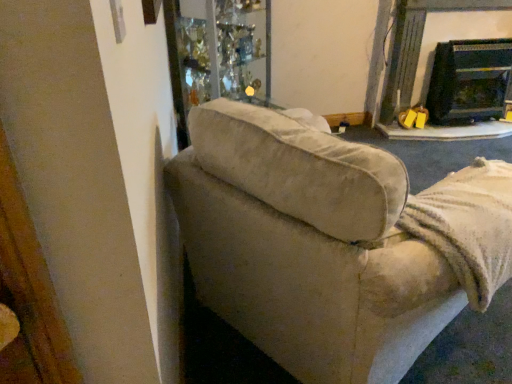
Question: Is the depth of beige fabric couch at left less than that of black glossy fireplace at upper right, which ranks as the second fireplace in right-to-left order?

Choices:
 (A) no
 (B) yes

Answer: (B)

Question: Is beige fabric couch at left placed right next to black glossy fireplace at upper right, which ranks as the second fireplace in right-to-left order?

Choices:
 (A) no
 (B) yes

Answer: (A)

Question: Could you tell me if beige fabric couch at left is turned towards black glossy fireplace at upper right, the first fireplace from the left?

Choices:
 (A) no
 (B) yes

Answer: (B)

Question: Does beige fabric couch at left contain black glossy fireplace at upper right, which ranks as the second fireplace in right-to-left order?

Choices:
 (A) no
 (B) yes

Answer: (A)

Question: Is beige fabric couch at left shorter than black glossy fireplace at upper right, which ranks as the second fireplace in right-to-left order?

Choices:
 (A) yes
 (B) no

Answer: (A)

Question: From the image's perspective, is beige fabric couch at left located beneath black glossy fireplace at upper right, which ranks as the second fireplace in right-to-left order?

Choices:
 (A) yes
 (B) no

Answer: (A)

Question: Considering the relative sizes of black glossy fireplace at upper right, which ranks as the second fireplace in right-to-left order, and beige fabric couch at left in the image provided, is black glossy fireplace at upper right, which ranks as the second fireplace in right-to-left order, wider than beige fabric couch at left?

Choices:
 (A) no
 (B) yes

Answer: (A)

Question: Is black glossy fireplace at upper right, the first fireplace from the left, at the right side of beige fabric couch at left?

Choices:
 (A) yes
 (B) no

Answer: (A)

Question: Considering the relative positions of black glossy fireplace at upper right, the first fireplace from the left, and beige fabric couch at left in the image provided, is black glossy fireplace at upper right, the first fireplace from the left, behind beige fabric couch at left?

Choices:
 (A) no
 (B) yes

Answer: (B)

Question: Is black glossy fireplace at upper right, the first fireplace from the left, next to beige fabric couch at left?

Choices:
 (A) yes
 (B) no

Answer: (B)

Question: From a real-world perspective, is black glossy fireplace at upper right, the first fireplace from the left, under beige fabric couch at left?

Choices:
 (A) yes
 (B) no

Answer: (B)

Question: From the image's perspective, is black glossy fireplace at upper right, the first fireplace from the left, under beige fabric couch at left?

Choices:
 (A) yes
 (B) no

Answer: (B)

Question: From a real-world perspective, is black glass fireplace at upper right, placed as the second fireplace when sorted from left to right, positioned over black glossy fireplace at upper right, the first fireplace from the left, based on gravity?

Choices:
 (A) no
 (B) yes

Answer: (A)